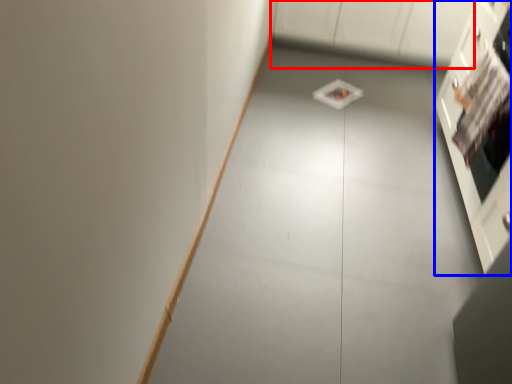
Question: Which point is further to the camera, cabinetry (highlighted by a red box) or cabinetry (highlighted by a blue box)?

Choices:
 (A) cabinetry
 (B) cabinetry

Answer: (A)